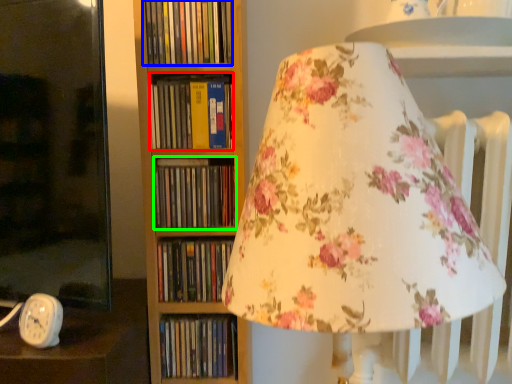
Question: Which is farther away from book (highlighted by a red box)? book (highlighted by a blue box) or book (highlighted by a green box)?

Choices:
 (A) book
 (B) book

Answer: (A)